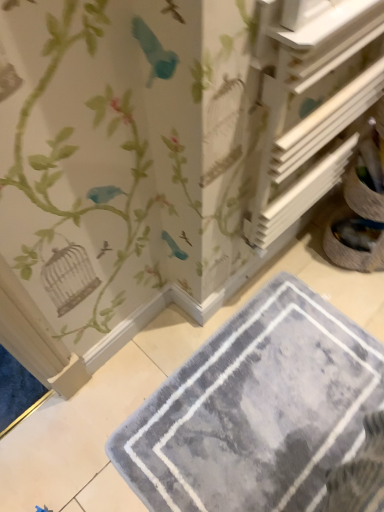
Describe the element at coordinates (255, 409) in the screenshot. I see `gray plush bath mat at lower center` at that location.

Locate an element on the screen. gray plush bath mat at lower center is located at coordinates (255, 409).

Where is `white wood shelf at upper right`? white wood shelf at upper right is located at coordinates (316, 109).

What do you see at coordinates (316, 109) in the screenshot? I see `white wood shelf at upper right` at bounding box center [316, 109].

This screenshot has width=384, height=512. Identify the location of gray plush bath mat at lower center. coord(255,409).

Based on the photo, which is more to the left, gray plush bath mat at lower center or white wood shelf at upper right?

Positioned to the left is gray plush bath mat at lower center.

Is gray plush bath mat at lower center behind white wood shelf at upper right?

Yes, gray plush bath mat at lower center is behind white wood shelf at upper right.

Does point (282, 463) appear closer or farther from the camera than point (302, 148)?

Point (282, 463).

From the image's perspective, is gray plush bath mat at lower center beneath white wood shelf at upper right?

Correct, gray plush bath mat at lower center appears lower than white wood shelf at upper right in the image.

Consider the image. From a real-world perspective, does gray plush bath mat at lower center sit lower than white wood shelf at upper right?

Yes, from a real-world perspective, gray plush bath mat at lower center is beneath white wood shelf at upper right.

In terms of width, does gray plush bath mat at lower center look wider or thinner when compared to white wood shelf at upper right?

Clearly, gray plush bath mat at lower center has more width compared to white wood shelf at upper right.

Who is shorter, gray plush bath mat at lower center or white wood shelf at upper right?

gray plush bath mat at lower center.

Based on the photo, considering the relative sizes of gray plush bath mat at lower center and white wood shelf at upper right in the image provided, is gray plush bath mat at lower center bigger than white wood shelf at upper right?

No.

Would you say gray plush bath mat at lower center is inside or outside white wood shelf at upper right?

gray plush bath mat at lower center cannot be found inside white wood shelf at upper right.

Would you say gray plush bath mat at lower center is a long distance from white wood shelf at upper right?

No.

Is gray plush bath mat at lower center aimed at white wood shelf at upper right?

No, gray plush bath mat at lower center is not turned towards white wood shelf at upper right.

How many degrees apart are the facing directions of gray plush bath mat at lower center and white wood shelf at upper right?

90.5 degrees separate the facing orientations of gray plush bath mat at lower center and white wood shelf at upper right.

Measure the distance between gray plush bath mat at lower center and white wood shelf at upper right.

The distance of gray plush bath mat at lower center from white wood shelf at upper right is 59.44 centimeters.

Locate an element on the screen. The height and width of the screenshot is (512, 384). shelf that appears in front of the gray plush bath mat at lower center is located at coordinates (316, 109).

Is white wood shelf at upper right at the right side of gray plush bath mat at lower center?

Yes, white wood shelf at upper right is to the right of gray plush bath mat at lower center.

Which object is closer to the camera, white wood shelf at upper right or gray plush bath mat at lower center?

white wood shelf at upper right is in front.

Does point (321, 139) lie in front of point (260, 439)?

Yes, point (321, 139) is in front of point (260, 439).

From the image's perspective, which is above, white wood shelf at upper right or gray plush bath mat at lower center?

From the image's view, white wood shelf at upper right is above.

From the picture: From a real-world perspective, is white wood shelf at upper right above or below gray plush bath mat at lower center?

white wood shelf at upper right is situated higher than gray plush bath mat at lower center in the real world.

Is white wood shelf at upper right wider than gray plush bath mat at lower center?

In fact, white wood shelf at upper right might be narrower than gray plush bath mat at lower center.

Who is shorter, white wood shelf at upper right or gray plush bath mat at lower center?

gray plush bath mat at lower center is shorter.

Which of these two, white wood shelf at upper right or gray plush bath mat at lower center, is bigger?

Bigger between the two is white wood shelf at upper right.

Does white wood shelf at upper right contain gray plush bath mat at lower center?

No, gray plush bath mat at lower center is located outside of white wood shelf at upper right.

Is white wood shelf at upper right positioned far away from gray plush bath mat at lower center?

No.

Is white wood shelf at upper right aimed at gray plush bath mat at lower center?

No.

How many degrees apart are the facing directions of white wood shelf at upper right and gray plush bath mat at lower center?

white wood shelf at upper right and gray plush bath mat at lower center are facing 90.5 degrees away from each other.

Find the location of a particular element. This screenshot has height=512, width=384. bath mat behind the white wood shelf at upper right is located at coordinates (255, 409).

The width and height of the screenshot is (384, 512). In order to click on shelf on the right of gray plush bath mat at lower center in this screenshot , I will do `click(316, 109)`.

This screenshot has width=384, height=512. Find the location of `bath mat below the white wood shelf at upper right (from a real-world perspective)`. bath mat below the white wood shelf at upper right (from a real-world perspective) is located at coordinates click(255, 409).